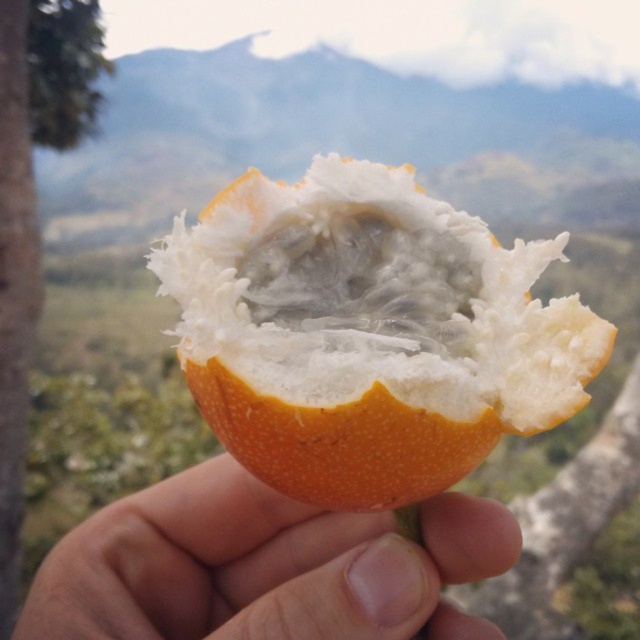
Can you confirm if orange skin at center is positioned to the right of green rough bark tree at left?

Indeed, orange skin at center is positioned on the right side of green rough bark tree at left.

Who is more forward, (x=392, y=550) or (x=8, y=465)?

Point (x=392, y=550)

Describe the element at coordinates (262, 566) in the screenshot. I see `orange skin at center` at that location.

You are a GUI agent. You are given a task and a screenshot of the screen. Output one action in this format:
    pyautogui.click(x=<x>, y=<y>)
    Task: Click on the orange skin at center
    Image resolution: width=640 pixels, height=640 pixels.
    Given the screenshot: What is the action you would take?
    pyautogui.click(x=262, y=566)

Does orangetextured/softfruit at center appear over green rough bark tree at left?

Actually, orangetextured/softfruit at center is below green rough bark tree at left.

Is point (316, 214) farther from viewer compared to point (56, 4)?

No, it is not.

Where is `orangetextured/softfruit at center`? Image resolution: width=640 pixels, height=640 pixels. orangetextured/softfruit at center is located at coordinates (369, 337).

Can you confirm if orangetextured/softfruit at center is smaller than orange skin at center?

Indeed, orangetextured/softfruit at center has a smaller size compared to orange skin at center.

Can you confirm if orangetextured/softfruit at center is taller than orange skin at center?

Yes.

Who is more distant from viewer, (324,444) or (291,506)?

The point (291,506) is more distant.

Image resolution: width=640 pixels, height=640 pixels. What are the coordinates of `orangetextured/softfruit at center` in the screenshot? It's located at (369, 337).